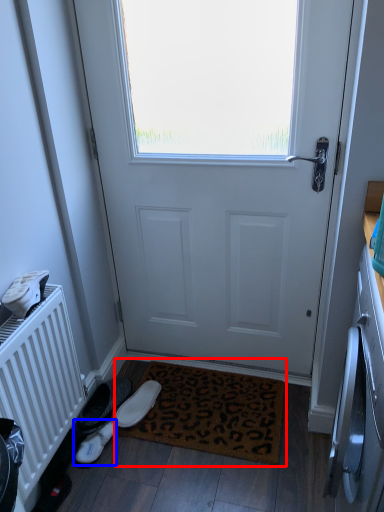
Question: Among these objects, which one is nearest to the camera, doormat (highlighted by a red box) or footwear (highlighted by a blue box)?

Choices:
 (A) doormat
 (B) footwear

Answer: (A)